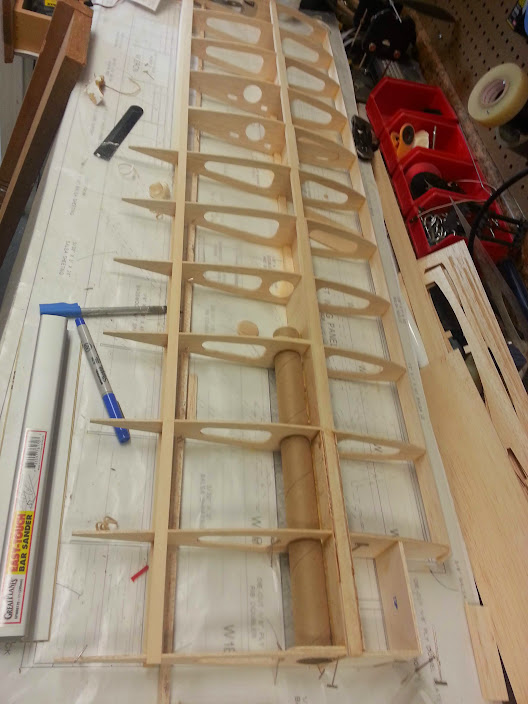
Find the location of a particular element. This screenshot has width=528, height=704. wood peg wall is located at coordinates (494, 27).